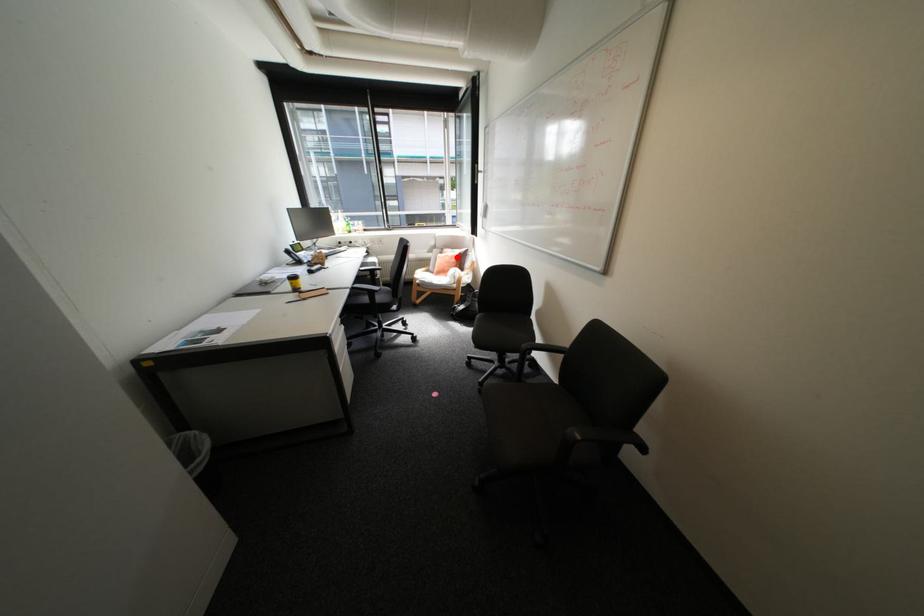
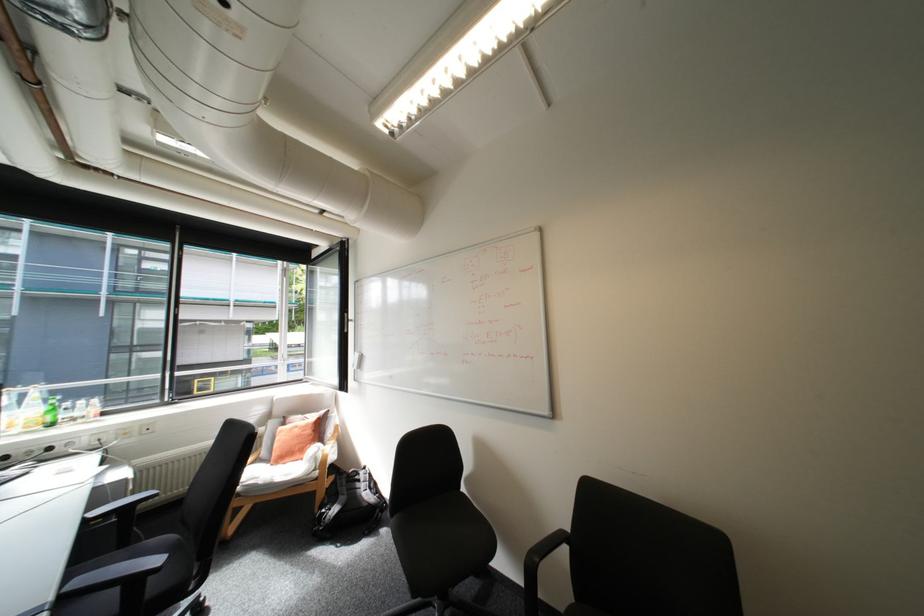
Locate, in the second image, the point that corresponds to the highlighted location in the first image.

(307, 429)